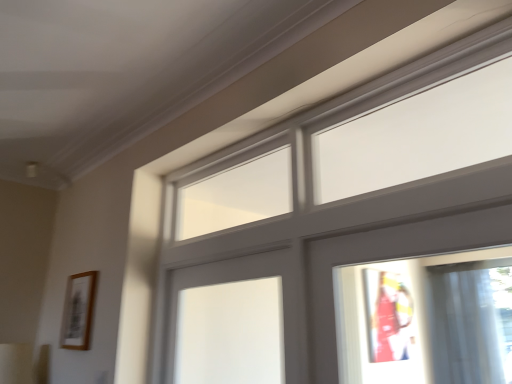
Question: From a real-world perspective, relative to wooden picture frame at left, is matte gray window at upper center vertically above or below?

Choices:
 (A) below
 (B) above

Answer: (B)

Question: Is point pos(437,334) positioned closer to the camera than point pos(64,336)?

Choices:
 (A) farther
 (B) closer

Answer: (A)

Question: Looking at the image, does matte gray window at upper center seem bigger or smaller compared to wooden picture frame at left?

Choices:
 (A) small
 (B) big

Answer: (B)

Question: Considering the positions of wooden picture frame at left and matte gray window at upper center in the image, is wooden picture frame at left bigger or smaller than matte gray window at upper center?

Choices:
 (A) big
 (B) small

Answer: (B)

Question: Is wooden picture frame at left spatially inside matte gray window at upper center, or outside of it?

Choices:
 (A) outside
 (B) inside

Answer: (A)

Question: Considering their positions, is wooden picture frame at left located in front of or behind matte gray window at upper center?

Choices:
 (A) front
 (B) behind

Answer: (B)

Question: In the image, is wooden picture frame at left on the left side or the right side of matte gray window at upper center?

Choices:
 (A) right
 (B) left

Answer: (B)